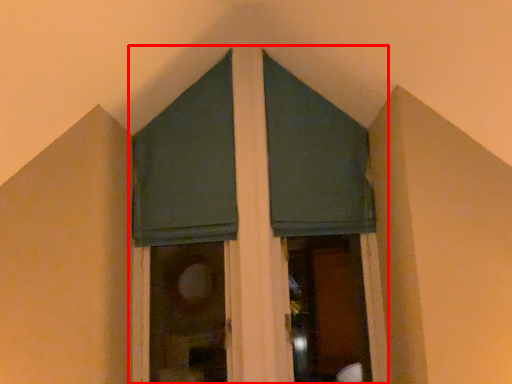
Question: From the image, what is the correct spatial relationship of bay window (annotated by the red box) in relation to window screen?

Choices:
 (A) left
 (B) right

Answer: (B)